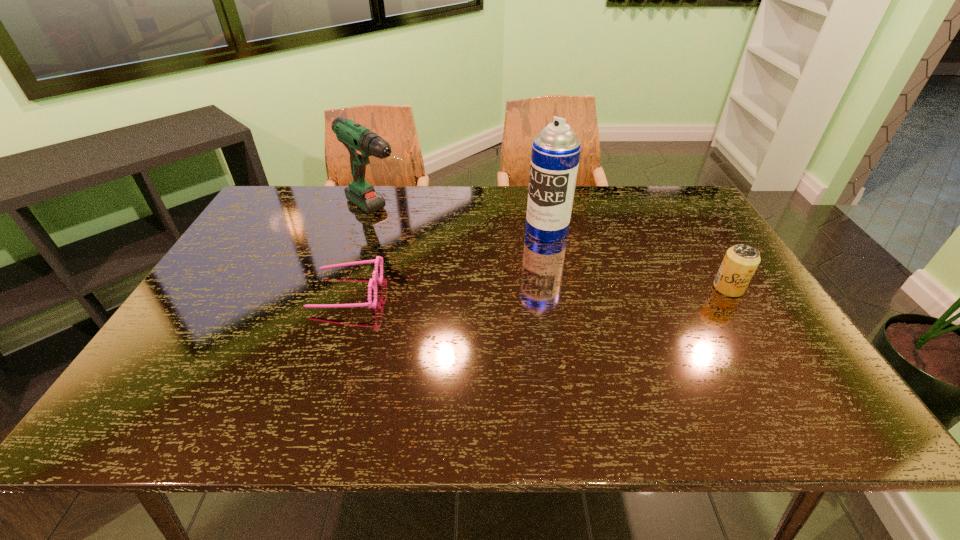
Locate an element on the screen. This screenshot has width=960, height=540. vacant space situated on the handle side of the drill is located at coordinates (484, 287).

Image resolution: width=960 pixels, height=540 pixels. I want to click on free location located on the handle side of the drill, so click(x=466, y=275).

Find the location of a particular element. The height and width of the screenshot is (540, 960). vacant area located on the handle side of the drill is located at coordinates (421, 244).

The width and height of the screenshot is (960, 540). Identify the location of blank area located 0.390m on the label side of the third object from left to right. (455, 315).

You are a GUI agent. You are given a task and a screenshot of the screen. Output one action in this format:
    pyautogui.click(x=<x>, y=<y>)
    Task: Click on the vacant space located 0.240m on the label side of the third object from left to right
    Image resolution: width=960 pixels, height=540 pixels.
    Given the screenshot: What is the action you would take?
    pyautogui.click(x=490, y=283)

You are a GUI agent. You are given a task and a screenshot of the screen. Output one action in this format:
    pyautogui.click(x=<x>, y=<y>)
    Task: Click on the vacant space situated on the label side of the third object from left to right
    This screenshot has height=540, width=960.
    Given the screenshot: What is the action you would take?
    pyautogui.click(x=488, y=285)

Find the location of a particular element. The image size is (960, 540). drill located at the far edge is located at coordinates (361, 143).

At what (x,y) coordinates should I click in order to perform the action: click on aerosol can that is at the far edge. Please return your answer as a coordinate pair (x, y). The width and height of the screenshot is (960, 540). Looking at the image, I should click on (555, 155).

Find the location of a particular element. Image resolution: width=960 pixels, height=540 pixels. object that is at the right edge is located at coordinates (741, 261).

In the image, there is a desktop. What are the coordinates of `vacant space at the far edge` in the screenshot? It's located at (426, 222).